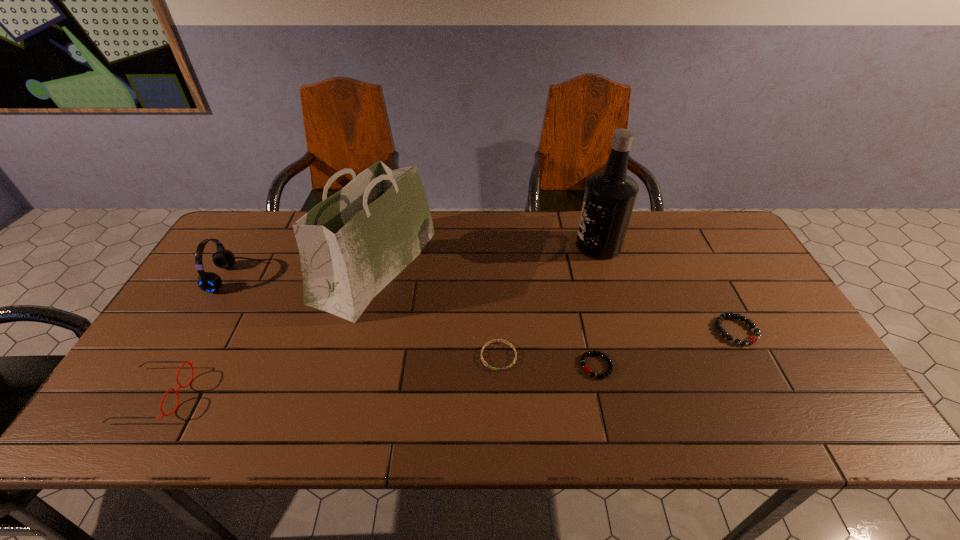
Locate an element on the screen. blank region between the tallest object and the second bracelet from left to right is located at coordinates (597, 306).

Identify the location of vacant area that lies between the fourth object from right to left and the tallest object. (548, 301).

Image resolution: width=960 pixels, height=540 pixels. Identify the location of free spot between the liquor and the third tallest object. (417, 261).

Find the location of a particular element. unoccupied position between the fourth object from right to left and the fifth shortest object is located at coordinates (367, 317).

Find the location of `free space that is in between the sixth shortest object and the tallest bracelet`. free space that is in between the sixth shortest object and the tallest bracelet is located at coordinates click(x=556, y=298).

The height and width of the screenshot is (540, 960). Identify the location of free spot between the liquor and the leftmost bracelet. (548, 301).

Where is `empty space that is in between the fourth object from right to left and the liquor`? Image resolution: width=960 pixels, height=540 pixels. empty space that is in between the fourth object from right to left and the liquor is located at coordinates (548, 301).

I want to click on empty location between the tallest object and the fourth tallest object, so 376,320.

The width and height of the screenshot is (960, 540). What are the coordinates of `free point between the liquor and the third object from left to right` in the screenshot? It's located at (487, 255).

In order to click on object that ranks as the closest to the grocery bag in this screenshot , I will do `click(489, 342)`.